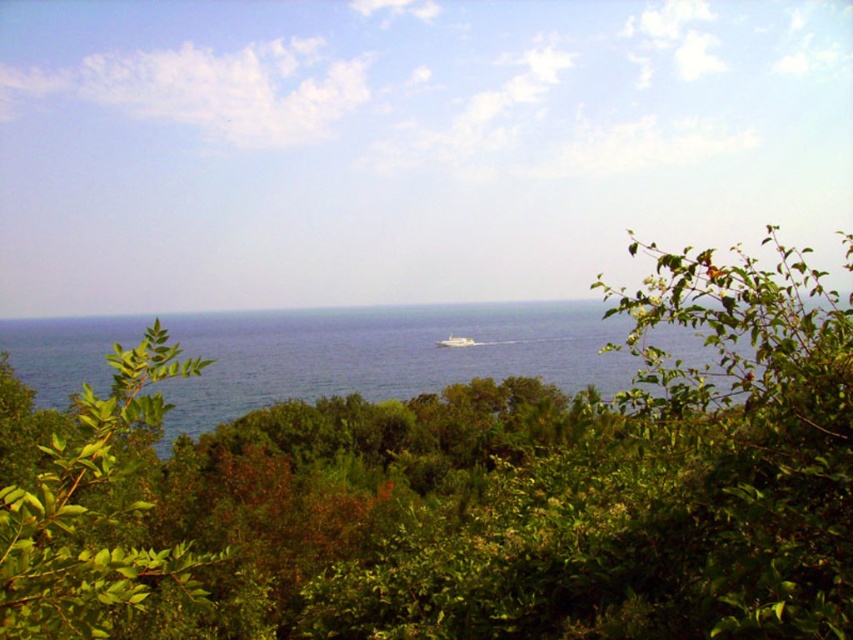
Question: Which object is the closest to the blue water at center?

Choices:
 (A) green leafy tree at center
 (B) white glossy boat at center

Answer: (B)

Question: Which point is farther from the camera taking this photo?

Choices:
 (A) (183, 410)
 (B) (51, 577)

Answer: (A)

Question: Among these points, which one is farthest from the camera?

Choices:
 (A) (27, 600)
 (B) (444, 358)

Answer: (B)

Question: Is green leafy tree at center thinner than white glossy boat at center?

Choices:
 (A) yes
 (B) no

Answer: (B)

Question: Is green leafy tree at center further to the viewer compared to white glossy boat at center?

Choices:
 (A) no
 (B) yes

Answer: (A)

Question: Considering the relative positions of blue water at center and green leafy tree at center in the image provided, where is blue water at center located with respect to green leafy tree at center?

Choices:
 (A) right
 (B) left

Answer: (A)